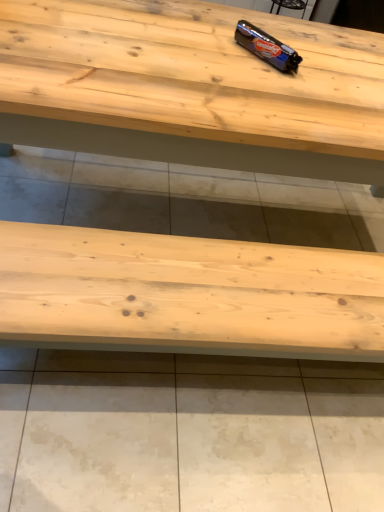
The width and height of the screenshot is (384, 512). What do you see at coordinates (267, 47) in the screenshot? I see `shiny metallic chocolate bar at upper center` at bounding box center [267, 47].

What are the coordinates of `shiny metallic chocolate bar at upper center` in the screenshot? It's located at (267, 47).

What do you see at coordinates (191, 88) in the screenshot?
I see `natural wood table at center` at bounding box center [191, 88].

The image size is (384, 512). In order to click on natural wood table at center in this screenshot , I will do pyautogui.click(x=191, y=88).

Image resolution: width=384 pixels, height=512 pixels. Find the location of `shiny metallic chocolate bar at upper center`. shiny metallic chocolate bar at upper center is located at coordinates point(267,47).

Between shiny metallic chocolate bar at upper center and natural wood table at center, which one appears on the left side from the viewer's perspective?

Positioned to the left is natural wood table at center.

Is the depth of shiny metallic chocolate bar at upper center less than that of natural wood table at center?

No.

Does point (292, 54) come closer to viewer compared to point (279, 116)?

That is False.

From the image's perspective, between shiny metallic chocolate bar at upper center and natural wood table at center, who is located below?

natural wood table at center appears lower in the image.

From a real-world perspective, is shiny metallic chocolate bar at upper center above or below natural wood table at center?

From a real-world perspective, shiny metallic chocolate bar at upper center is physically above natural wood table at center.

Considering the sizes of objects shiny metallic chocolate bar at upper center and natural wood table at center in the image provided, who is thinner, shiny metallic chocolate bar at upper center or natural wood table at center?

shiny metallic chocolate bar at upper center is thinner.

Considering the sizes of shiny metallic chocolate bar at upper center and natural wood table at center in the image, is shiny metallic chocolate bar at upper center taller or shorter than natural wood table at center?

Considering their sizes, shiny metallic chocolate bar at upper center has less height than natural wood table at center.

Consider the image. Which of these two, shiny metallic chocolate bar at upper center or natural wood table at center, is bigger?

natural wood table at center is bigger.

In the scene shown: Is shiny metallic chocolate bar at upper center surrounding natural wood table at center?

That's incorrect, natural wood table at center is not inside shiny metallic chocolate bar at upper center.

Is shiny metallic chocolate bar at upper center in contact with natural wood table at center?

No, shiny metallic chocolate bar at upper center is not making contact with natural wood table at center.

Is shiny metallic chocolate bar at upper center positioned with its back to natural wood table at center?

No.

Can you tell me how much shiny metallic chocolate bar at upper center and natural wood table at center differ in facing direction?

52.4 degrees separate the facing orientations of shiny metallic chocolate bar at upper center and natural wood table at center.

Where is `chocolate bar above the natural wood table at center (from the image's perspective)`? The width and height of the screenshot is (384, 512). chocolate bar above the natural wood table at center (from the image's perspective) is located at coordinates [x=267, y=47].

Between natural wood table at center and shiny metallic chocolate bar at upper center, which one appears on the right side from the viewer's perspective?

shiny metallic chocolate bar at upper center is more to the right.

Who is more distant, natural wood table at center or shiny metallic chocolate bar at upper center?

Positioned behind is shiny metallic chocolate bar at upper center.

Which is nearer, (68,119) or (257,45)?

Point (68,119)

From the image's perspective, is natural wood table at center on top of shiny metallic chocolate bar at upper center?

Actually, natural wood table at center appears below shiny metallic chocolate bar at upper center in the image.

From a real-world perspective, between natural wood table at center and shiny metallic chocolate bar at upper center, who is vertically higher?

shiny metallic chocolate bar at upper center is physically above.

Between natural wood table at center and shiny metallic chocolate bar at upper center, which one has larger width?

natural wood table at center is wider.

In terms of height, does natural wood table at center look taller or shorter compared to shiny metallic chocolate bar at upper center?

In the image, natural wood table at center appears to be taller than shiny metallic chocolate bar at upper center.

Can you confirm if natural wood table at center is smaller than shiny metallic chocolate bar at upper center?

No.

Is natural wood table at center situated inside shiny metallic chocolate bar at upper center or outside?

natural wood table at center cannot be found inside shiny metallic chocolate bar at upper center.

In the scene shown: Is natural wood table at center beside shiny metallic chocolate bar at upper center?

No, natural wood table at center is not with shiny metallic chocolate bar at upper center.

Could you tell me if natural wood table at center is facing shiny metallic chocolate bar at upper center?

No, natural wood table at center is not facing towards shiny metallic chocolate bar at upper center.

How distant is natural wood table at center from shiny metallic chocolate bar at upper center?

The distance of natural wood table at center from shiny metallic chocolate bar at upper center is 12.19 inches.

Locate an element on the screen. Image resolution: width=384 pixels, height=512 pixels. table on the left side of shiny metallic chocolate bar at upper center is located at coordinates (191, 88).

Identify the location of chocolate bar that appears above the natural wood table at center (from the image's perspective). (267, 47).

The width and height of the screenshot is (384, 512). I want to click on chocolate bar that is on the right side of natural wood table at center, so click(x=267, y=47).